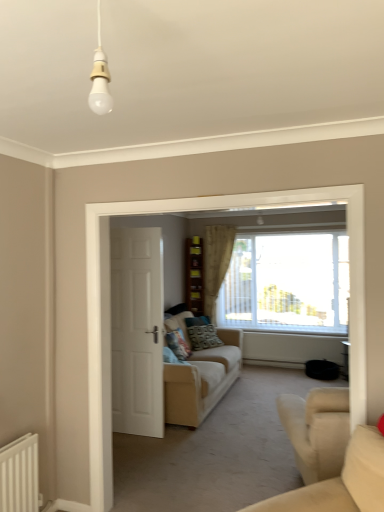
Question: Is beige fabric couch at center, the 1th studio couch in the back-to-front sequence, taller than wooden shelves at center?

Choices:
 (A) yes
 (B) no

Answer: (B)

Question: Considering the relative sizes of beige fabric couch at center, placed as the second studio couch when sorted from front to back, and wooden shelves at center in the image provided, is beige fabric couch at center, placed as the second studio couch when sorted from front to back, thinner than wooden shelves at center?

Choices:
 (A) yes
 (B) no

Answer: (B)

Question: Is beige fabric couch at center, placed as the second studio couch when sorted from front to back, smaller than wooden shelves at center?

Choices:
 (A) no
 (B) yes

Answer: (A)

Question: Is beige fabric couch at center, placed as the second studio couch when sorted from front to back, directly adjacent to wooden shelves at center?

Choices:
 (A) yes
 (B) no

Answer: (B)

Question: From the image's perspective, would you say beige fabric couch at center, the 1th studio couch in the back-to-front sequence, is shown under wooden shelves at center?

Choices:
 (A) yes
 (B) no

Answer: (A)

Question: Would you say patterned fabric pillow at center, the first pillow from the left, is to the left or to the right of beige fabric couch at center, the 1th studio couch in the back-to-front sequence, in the picture?

Choices:
 (A) right
 (B) left

Answer: (B)

Question: From a real-world perspective, is patterned fabric pillow at center, which appears as the first pillow when viewed from the front, positioned above or below beige fabric couch at center, placed as the second studio couch when sorted from front to back?

Choices:
 (A) below
 (B) above

Answer: (B)

Question: Is patterned fabric pillow at center, which appears as the 2th pillow when viewed from the right, in front of or behind beige fabric couch at center, placed as the second studio couch when sorted from front to back, in the image?

Choices:
 (A) front
 (B) behind

Answer: (B)

Question: Considering the positions of patterned fabric pillow at center, the second pillow positioned from the back, and beige fabric couch at center, placed as the second studio couch when sorted from front to back, in the image, is patterned fabric pillow at center, the second pillow positioned from the back, taller or shorter than beige fabric couch at center, placed as the second studio couch when sorted from front to back,?

Choices:
 (A) tall
 (B) short

Answer: (B)

Question: Is beige fabric curtain at center wider or thinner than wooden shelves at center?

Choices:
 (A) wide
 (B) thin

Answer: (B)

Question: Is point (208, 312) closer or farther from the camera than point (187, 264)?

Choices:
 (A) farther
 (B) closer

Answer: (B)

Question: From a real-world perspective, is beige fabric curtain at center positioned above or below wooden shelves at center?

Choices:
 (A) above
 (B) below

Answer: (A)

Question: Would you say beige fabric curtain at center is to the left or to the right of wooden shelves at center in the picture?

Choices:
 (A) left
 (B) right

Answer: (B)

Question: Is beige fabric couch at center, placed as the second studio couch when sorted from front to back, wider or thinner than white matte door at center?

Choices:
 (A) wide
 (B) thin

Answer: (A)

Question: Relative to white matte door at center, is beige fabric couch at center, placed as the second studio couch when sorted from front to back, in front or behind?

Choices:
 (A) front
 (B) behind

Answer: (A)